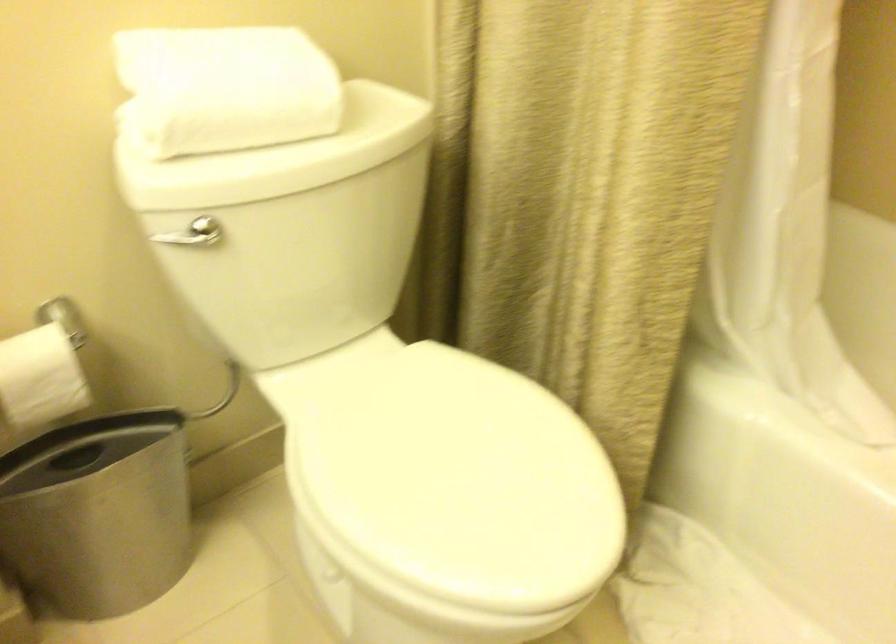
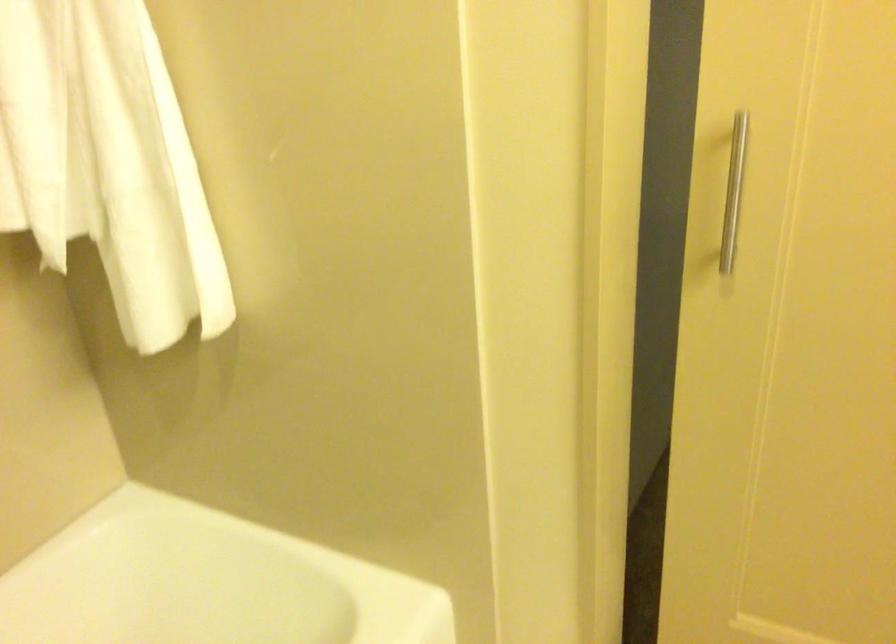
How did the camera likely rotate?

The rotation direction of the camera is right-down.